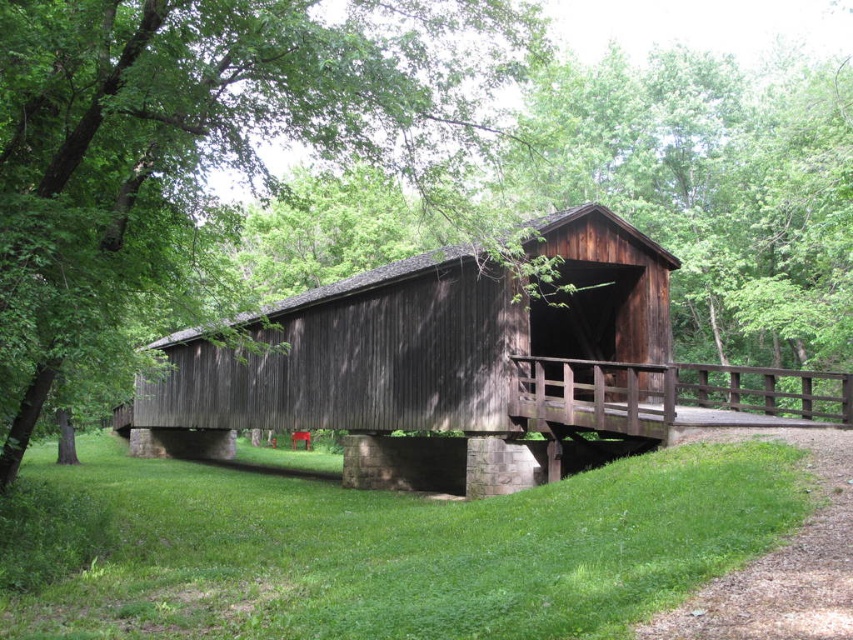
Is point (294, 352) positioned in front of point (798, 604)?

No, (294, 352) is behind (798, 604).

Which of these two, dark brown wooden bridge at center or green grass at lower right, stands shorter?

Standing shorter between the two is green grass at lower right.

Is point (204, 358) positioned behind point (685, 634)?

Yes.

You are a GUI agent. You are given a task and a screenshot of the screen. Output one action in this format:
    pyautogui.click(x=<x>, y=<y>)
    Task: Click on the dark brown wooden bridge at center
    This screenshot has width=853, height=640.
    Given the screenshot: What is the action you would take?
    tap(415, 358)

Can you confirm if green wood tree at center is thinner than green grass at lower right?

No, green wood tree at center is not thinner than green grass at lower right.

Measure the distance between green wood tree at center and green grass at lower right.

A distance of 8.86 meters exists between green wood tree at center and green grass at lower right.

Find the location of `green wood tree at center`. green wood tree at center is located at coordinates click(x=200, y=138).

I want to click on green wood tree at center, so click(200, 138).

Who is more forward, (74, 276) or (479, 280)?

Point (74, 276) is in front.

Does green wood tree at center have a lesser width compared to dark brown wooden bridge at center?

Result: Indeed, green wood tree at center has a lesser width compared to dark brown wooden bridge at center.

Is point (80, 116) positioned in front of point (608, 378)?

Yes.

Identify the location of green wood tree at center. The height and width of the screenshot is (640, 853). (200, 138).